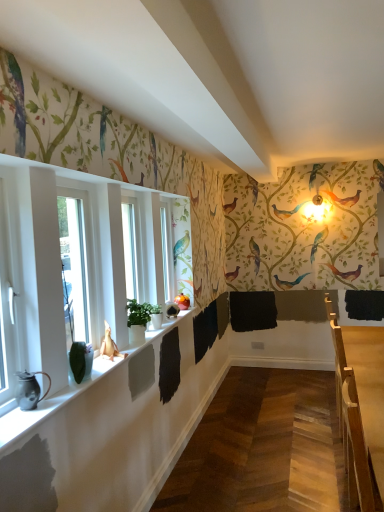
Question: Is point (3, 201) positioned closer to the camera than point (357, 349)?

Choices:
 (A) closer
 (B) farther

Answer: (A)

Question: From the image's perspective, is white glossy window at left positioned above or below wooden table at right?

Choices:
 (A) above
 (B) below

Answer: (A)

Question: Which object is the closest to the green matte plant at left?

Choices:
 (A) wooden table at right
 (B) white glossy window at left
 (C) matte white window sill at lower left

Answer: (C)

Question: Which is farther from the white glossy window at left?

Choices:
 (A) matte white window sill at lower left
 (B) wooden table at right
 (C) green matte plant at left

Answer: (B)